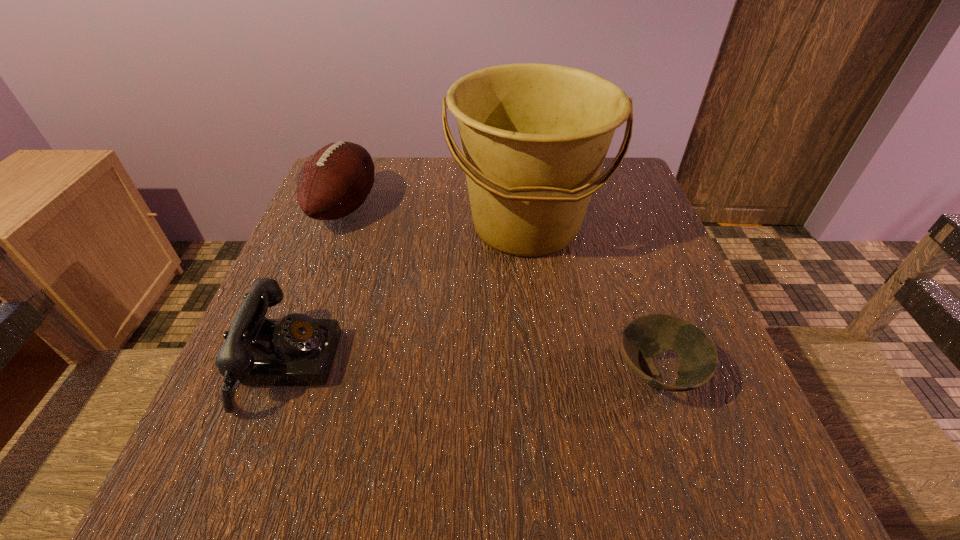
In order to click on free location that satisfies the following two spatial constraints: 1. on the side of the bucket with the handle; 2. on the left side of the bowl in this screenshot , I will do `click(544, 374)`.

Locate an element on the screen. The width and height of the screenshot is (960, 540). vacant area that satisfies the following two spatial constraints: 1. on the side of the bucket with the handle; 2. on the dial of the second shortest object is located at coordinates (543, 364).